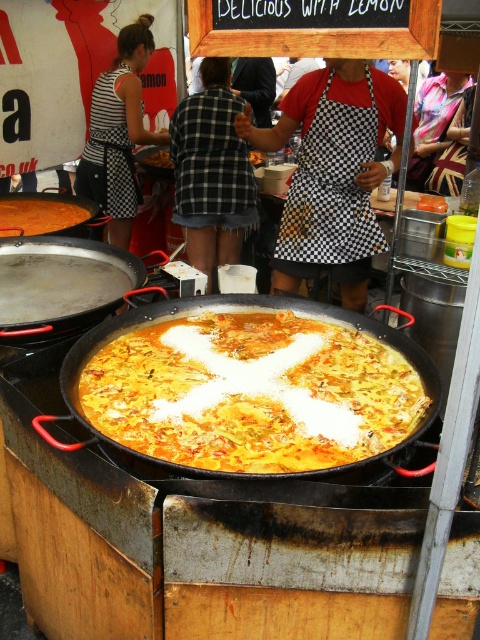
Question: Is wooden frame at upper center bigger than matte black wok at center?

Choices:
 (A) no
 (B) yes

Answer: (A)

Question: Which point is closer to the camera taking this photo?

Choices:
 (A) (155, 156)
 (B) (300, 192)

Answer: (B)

Question: Where is matte black wok at center located in relation to striped fabric apron at left in the image?

Choices:
 (A) below
 (B) above

Answer: (A)

Question: Which point is farther to the camera?

Choices:
 (A) brown crispy pastry at center
 (B) black checkered apron at center
 (C) matte black wok at center

Answer: (A)

Question: Among these points, which one is farthest from the camera?

Choices:
 (A) (257, 28)
 (B) (119, 260)
 (C) (106, 131)

Answer: (C)

Question: Where is yellowish matte paella at center located in relation to brown crispy pastry at center in the image?

Choices:
 (A) right
 (B) left

Answer: (B)